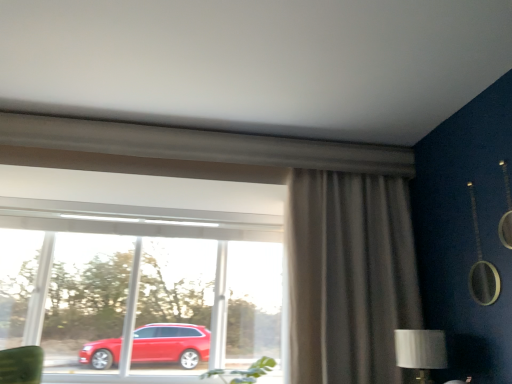
Question: Is silver metallic table lamp at lower right in front of matte gray curtain at right?

Choices:
 (A) yes
 (B) no

Answer: (A)

Question: Considering the relative positions of silver metallic table lamp at lower right and matte gray curtain at right in the image provided, is silver metallic table lamp at lower right to the left of matte gray curtain at right from the viewer's perspective?

Choices:
 (A) yes
 (B) no

Answer: (B)

Question: Considering the relative sizes of silver metallic table lamp at lower right and matte gray curtain at right in the image provided, is silver metallic table lamp at lower right shorter than matte gray curtain at right?

Choices:
 (A) no
 (B) yes

Answer: (B)

Question: Considering the relative sizes of silver metallic table lamp at lower right and matte gray curtain at right in the image provided, is silver metallic table lamp at lower right thinner than matte gray curtain at right?

Choices:
 (A) yes
 (B) no

Answer: (A)

Question: Is silver metallic table lamp at lower right facing towards matte gray curtain at right?

Choices:
 (A) yes
 (B) no

Answer: (B)

Question: Is silver metallic table lamp at lower right wider than matte gray curtain at right?

Choices:
 (A) yes
 (B) no

Answer: (B)

Question: Is transparent glass window at center positioned in front of silver metallic table lamp at lower right?

Choices:
 (A) yes
 (B) no

Answer: (B)

Question: Can you confirm if transparent glass window at center is bigger than silver metallic table lamp at lower right?

Choices:
 (A) yes
 (B) no

Answer: (A)

Question: From a real-world perspective, does transparent glass window at center sit lower than silver metallic table lamp at lower right?

Choices:
 (A) no
 (B) yes

Answer: (A)

Question: From the image's perspective, is transparent glass window at center located above silver metallic table lamp at lower right?

Choices:
 (A) yes
 (B) no

Answer: (A)

Question: Can you confirm if transparent glass window at center is wider than silver metallic table lamp at lower right?

Choices:
 (A) yes
 (B) no

Answer: (B)

Question: Does transparent glass window at center have a smaller size compared to silver metallic table lamp at lower right?

Choices:
 (A) no
 (B) yes

Answer: (A)

Question: Is matte gray curtain at right facing towards transparent glass window at center?

Choices:
 (A) no
 (B) yes

Answer: (A)